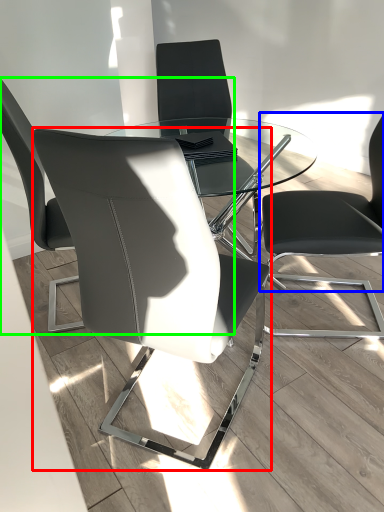
Question: Estimate the real-world distances between objects in this image. Which object is farther from chair (highlighted by a red box), chair (highlighted by a blue box) or chair (highlighted by a green box)?

Choices:
 (A) chair
 (B) chair

Answer: (A)